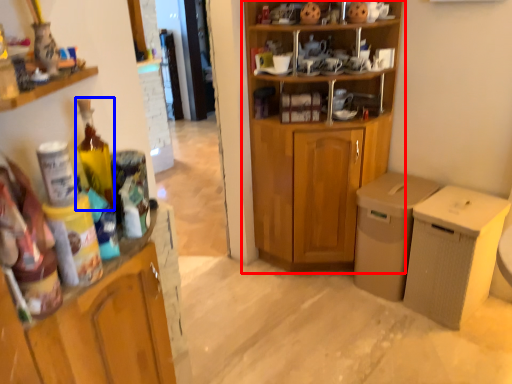
Question: Which object appears closest to the camera in this image, cupboard (highlighted by a red box) or bottle (highlighted by a blue box)?

Choices:
 (A) cupboard
 (B) bottle

Answer: (B)